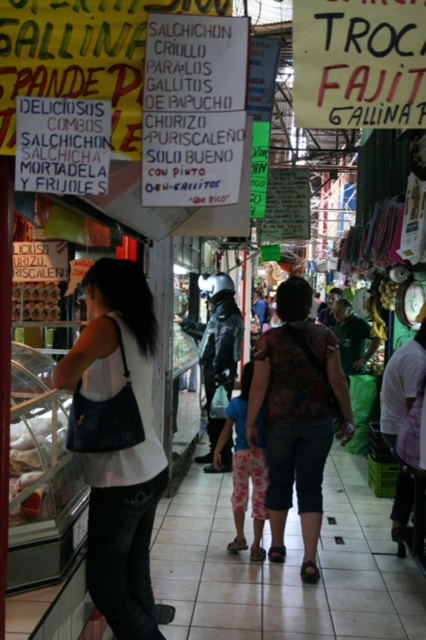
Where is `matte black bag at left`? matte black bag at left is located at coordinates (118, 442).

You are a GUI agent. You are given a task and a screenshot of the screen. Output one action in this format:
    pyautogui.click(x=<x>, y=<y>)
    Task: Click on the matte black bag at left
    The height and width of the screenshot is (640, 426).
    Given the screenshot: What is the action you would take?
    pyautogui.click(x=118, y=442)

Is matte black bag at left positioned at the back of white paper sign at upper center?

Yes, it is behind white paper sign at upper center.

Is matte black bag at left shorter than white paper sign at upper center?

No.

Where is `matte black bag at left`? This screenshot has width=426, height=640. matte black bag at left is located at coordinates (118, 442).

Consider the image. Is matte black bag at left smaller than printed fabric blouse at center?

Yes, matte black bag at left is smaller than printed fabric blouse at center.

Is matte black bag at left to the right of printed fabric blouse at center from the viewer's perspective?

Incorrect, matte black bag at left is not on the right side of printed fabric blouse at center.

Is point (120, 504) positioned before point (284, 548)?

Yes, point (120, 504) is in front of point (284, 548).

Find the location of a particular element. This screenshot has height=640, width=426. matte black bag at left is located at coordinates (118, 442).